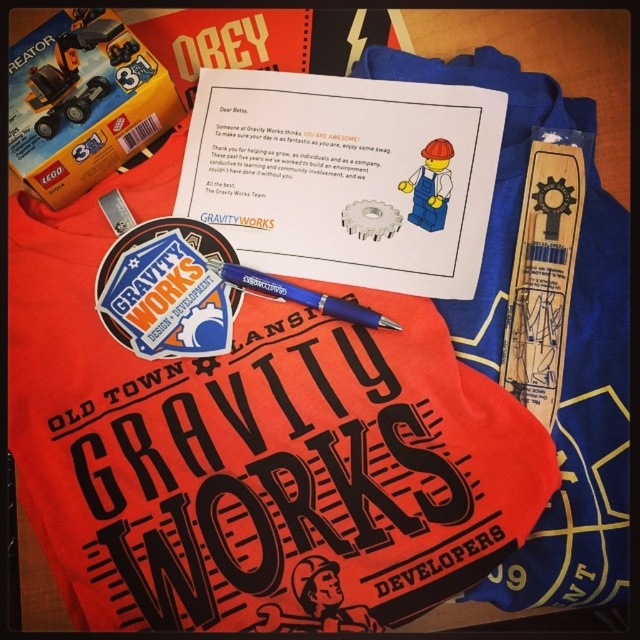
Question: From the image, what is the correct spatial relationship of matte sticker at center in relation to matte plastic minifigure at center?

Choices:
 (A) right
 (B) left

Answer: (B)

Question: Is matte sticker at center bigger than blue plastic pen at center?

Choices:
 (A) no
 (B) yes

Answer: (B)

Question: Based on their relative distances, which object is farther from the matte sticker at center?

Choices:
 (A) matte plastic minifigure at center
 (B) matte black t-shirt at center

Answer: (A)

Question: Estimate the real-world distances between objects in this image. Which object is closer to the blue plastic pen at center?

Choices:
 (A) matte black t-shirt at center
 (B) matte plastic minifigure at center

Answer: (B)

Question: Does blue plastic pen at center have a larger size compared to matte plastic minifigure at center?

Choices:
 (A) yes
 (B) no

Answer: (A)

Question: Which point appears farthest from the camera in this image?

Choices:
 (A) (166, 250)
 (B) (326, 307)

Answer: (A)